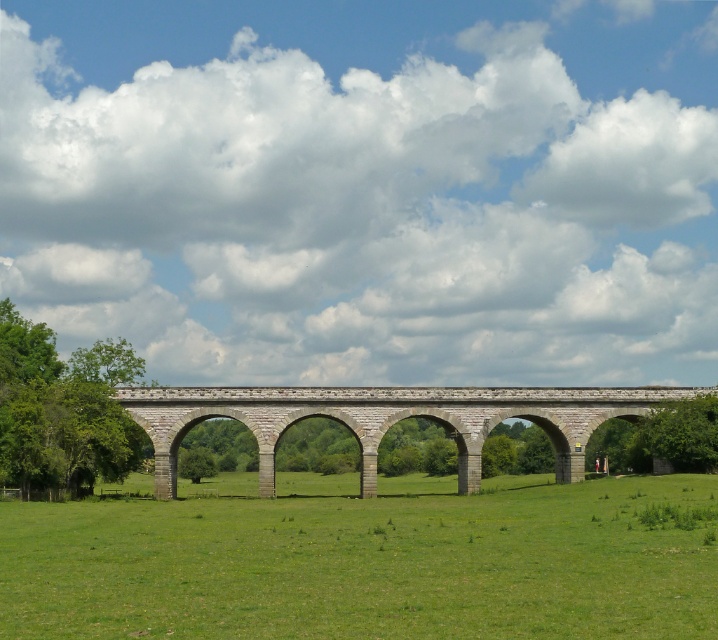
You are standing on the large stone viaduct and want to get to the green grassy field at center. Which direction should you move to reach it?

The green grassy field at center is located at point (365, 563), so you should move downward from the viaduct to reach it.

You are standing at the base of the viaduct and want to walk towards the horizon. Which point, point (x=633, y=572) or point (x=686, y=419), would you reach first?

Point (x=633, y=572) is in front of point (x=686, y=419), so you would reach point (x=633, y=572) first.

You are a drone operator trying to capture the entire gray stone bridge at center and green grassy field at center in one photo. Given that the drone can only focus on objects within a 10 meter height range, will both objects be in focus?

The green grassy field at center is shorter than the gray stone bridge at center. Since the drone can only focus on objects within a 10 meter height range, if the height difference between them is less than 10 meters, both will be in focus. However, the exact height difference isn not provided, so it cannot be determined conclusively.